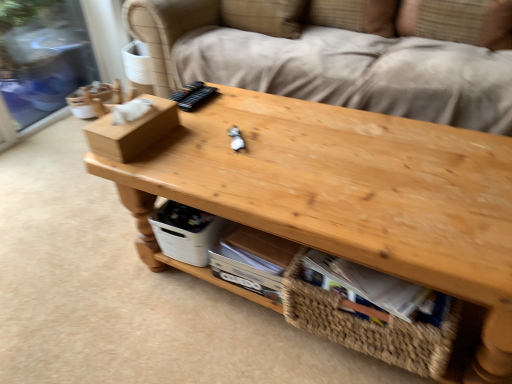
Identify the location of free space above white plastic storage box at lower center (from a real-world perspective). The width and height of the screenshot is (512, 384). (184, 214).